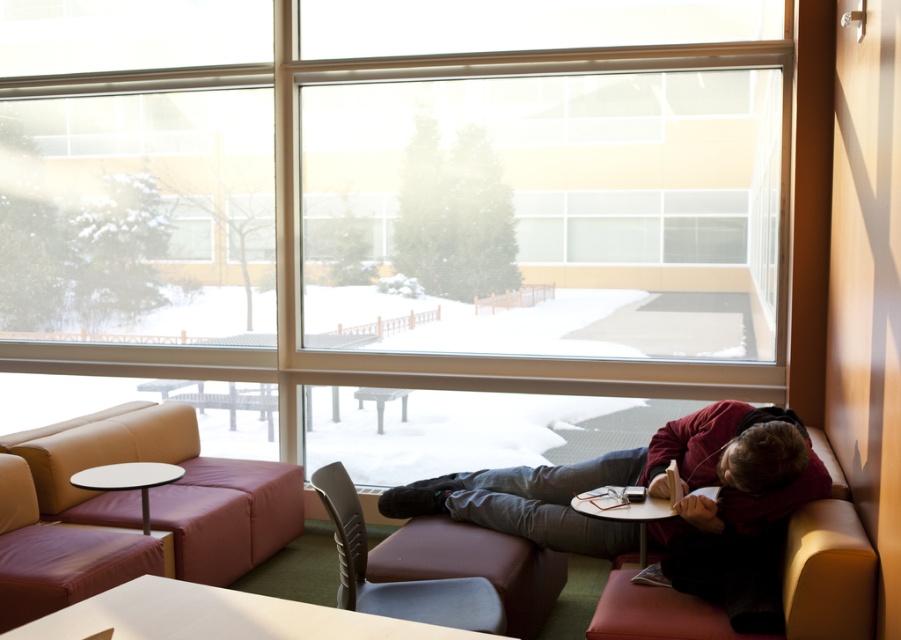
You are standing in the lounge area and want to place a small potted plant at the point marked as point [663,595]. If your arm can reach up to 8 feet, can you place the plant there without moving closer?

The distance of point [663,595] from the camera is 8.55 feet, which is beyond your arm reach of 8 feet. You need to move closer to place the plant.